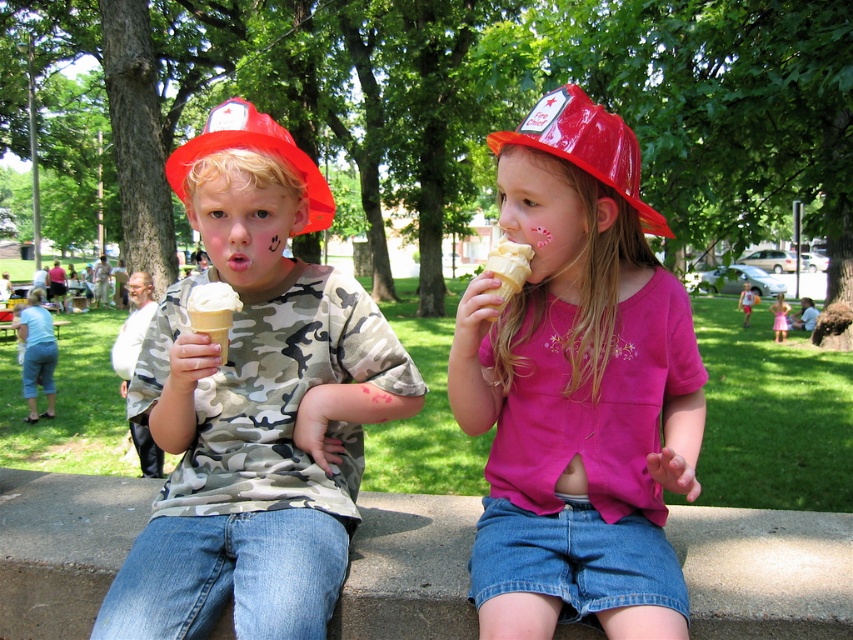
Is white creamy ice cream cone at center smaller than pink satin dress at center?

Correct, white creamy ice cream cone at center occupies less space than pink satin dress at center.

Does point (196, 288) come closer to viewer compared to point (781, 310)?

Yes, it is.

Identify the location of white creamy ice cream cone at center. This screenshot has width=853, height=640. (213, 312).

Who is taller, red plastic hat at upper center or pink satin dress at center?

pink satin dress at center is taller.

Can you confirm if red plastic hat at upper center is taller than pink satin dress at center?

No.

The image size is (853, 640). I want to click on red plastic hat at upper center, so click(585, 145).

Can you confirm if pink matte shirt at center is positioned to the right of red plastic fire hat at left?

Correct, you'll find pink matte shirt at center to the right of red plastic fire hat at left.

Does point (457, 342) come closer to viewer compared to point (202, 138)?

That is True.

Find the location of `pink matte shirt at center`. pink matte shirt at center is located at coordinates point(578,385).